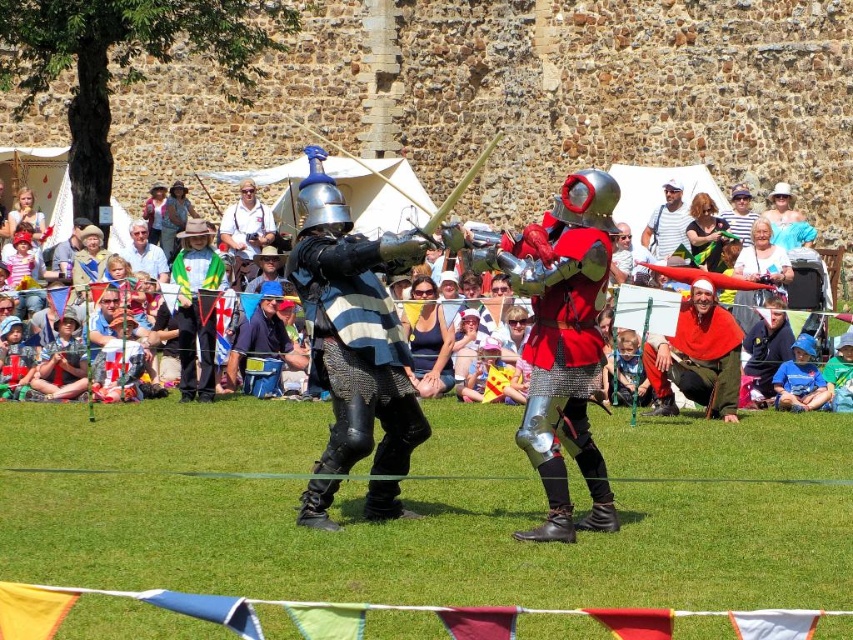
You are a knight in the medieval festival. You see the shiny silver armor at center and the light brown leather jacket at center. Which one is bigger?

The shiny silver armor at center is larger in size than the light brown leather jacket at center.

You are standing in the medieval festival area and notice two points marked in the scene. Which point is closer to you, point (339, 467) or point (640, 179)?

Point (339, 467) is closer to the viewer than point (640, 179).